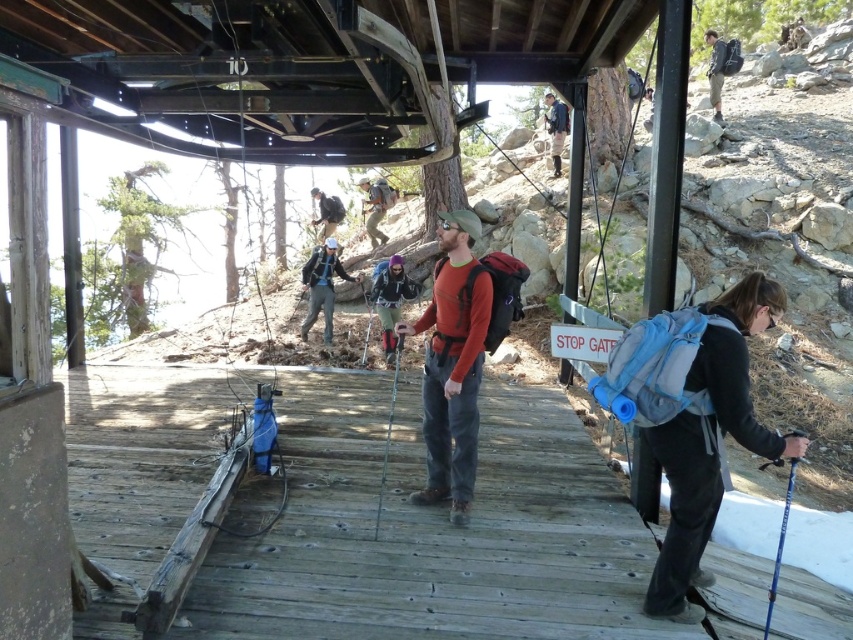
You are a hiker preparing to pack your gear. You have an orange fleece jacket at center and a blue fabric backpack at upper center. Which item should you choose if you need something that takes up less space?

The orange fleece jacket at center is smaller than the blue fabric backpack at upper center, so you should choose the orange fleece jacket at center as it takes up less space.

You are a hiker planning to carry both the blue fabric backpack at upper center and the matte gray backpack at center. Which backpack can hold more items?

The blue fabric backpack at upper center is larger in size than the matte gray backpack at center, so it can hold more items.